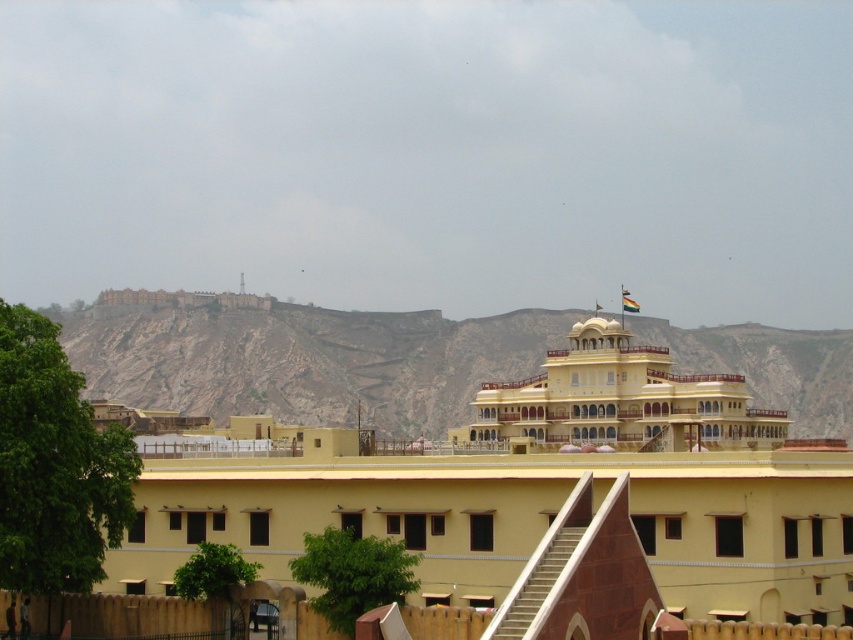
Question: Can you confirm if yellow matte building at center is smaller than brown rocky mountain at upper left?

Choices:
 (A) yes
 (B) no

Answer: (A)

Question: Which object is farther from the camera taking this photo?

Choices:
 (A) matte yellow building at center
 (B) brown rocky mountain at upper left

Answer: (B)

Question: Which of the following is the closest to the observer?

Choices:
 (A) (653, 371)
 (B) (448, 404)

Answer: (A)

Question: Can you confirm if yellow matte building at center is positioned below brown rocky mountain at upper left?

Choices:
 (A) no
 (B) yes

Answer: (A)

Question: Is yellow matte building at center further to the viewer compared to brown rocky mountain at upper left?

Choices:
 (A) yes
 (B) no

Answer: (B)

Question: Which object is closer to the camera taking this photo?

Choices:
 (A) matte yellow building at center
 (B) yellow matte building at center

Answer: (B)